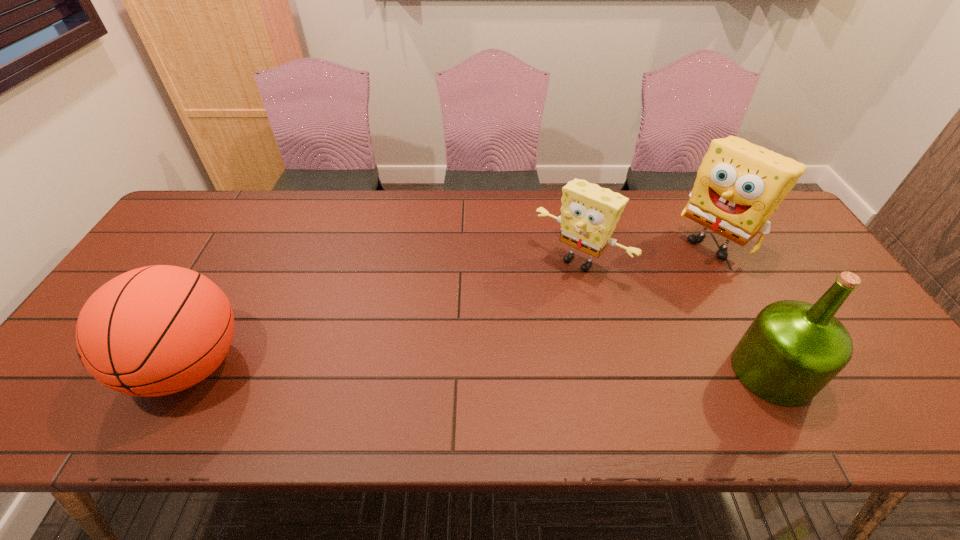
The width and height of the screenshot is (960, 540). In order to click on basketball in this screenshot , I will do `click(156, 330)`.

Where is `olive oil`? Image resolution: width=960 pixels, height=540 pixels. olive oil is located at coordinates (792, 349).

This screenshot has width=960, height=540. What are the coordinates of `the left sponge` in the screenshot? It's located at (589, 214).

This screenshot has height=540, width=960. I want to click on the second object from left to right, so click(x=589, y=214).

Where is `the taller sponge`? Image resolution: width=960 pixels, height=540 pixels. the taller sponge is located at coordinates pyautogui.click(x=739, y=185).

At what (x,y) coordinates should I click in order to perform the action: click on vacant space located on the side with logo of the leftmost object. Please return your answer as a coordinate pair (x, y). The width and height of the screenshot is (960, 540). Looking at the image, I should click on [103, 366].

This screenshot has height=540, width=960. Find the location of `free space located on the side with logo of the leftmost object`. free space located on the side with logo of the leftmost object is located at coordinates (73, 366).

Where is `free space located on the back of the olive oil`? The image size is (960, 540). free space located on the back of the olive oil is located at coordinates (742, 315).

I want to click on free space located on the face of the second object from left to right, so click(509, 335).

Locate an element on the screen. The width and height of the screenshot is (960, 540). vacant area situated on the face of the second object from left to right is located at coordinates 490,356.